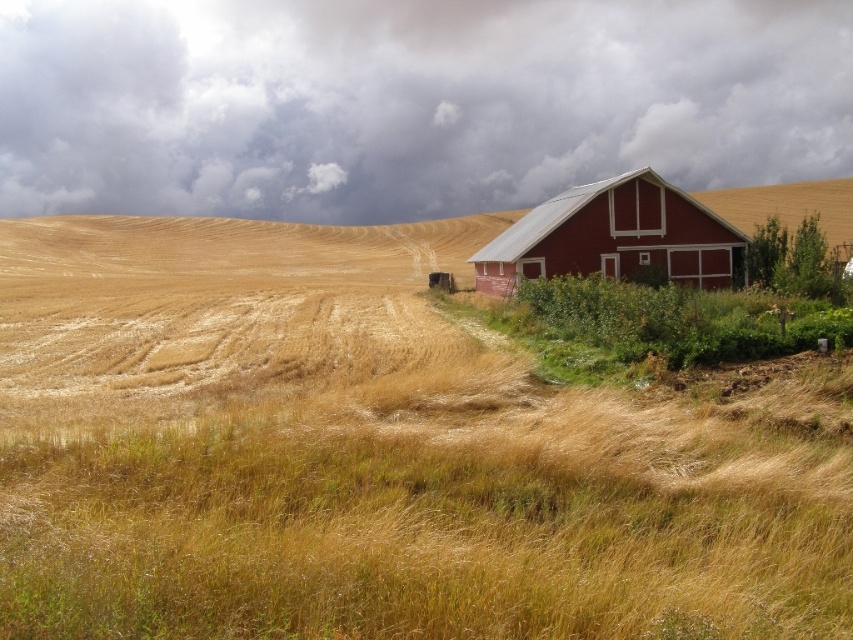
From the picture: Is dry grass at lower center to the right of dark gray cloud at upper center from the viewer's perspective?

No, dry grass at lower center is not to the right of dark gray cloud at upper center.

Between dry grass at lower center and dark gray cloud at upper center, which one has more height?

With more height is dark gray cloud at upper center.

Which is in front, point (56, 561) or point (848, 90)?

Point (56, 561) is more forward.

Where is `dry grass at lower center`? The height and width of the screenshot is (640, 853). dry grass at lower center is located at coordinates (396, 483).

Does dry grass at lower center come behind matte red barn at right?

That is False.

Identify the location of dry grass at lower center. (396, 483).

Who is positioned more to the left, dark gray cloud at upper center or matte red barn at right?

Positioned to the left is dark gray cloud at upper center.

Can you confirm if dark gray cloud at upper center is taller than matte red barn at right?

Result: Yes, dark gray cloud at upper center is taller than matte red barn at right.

Which is in front, point (786, 38) or point (514, 273)?

Point (514, 273) is more forward.

Where is `dark gray cloud at upper center`? dark gray cloud at upper center is located at coordinates (408, 104).